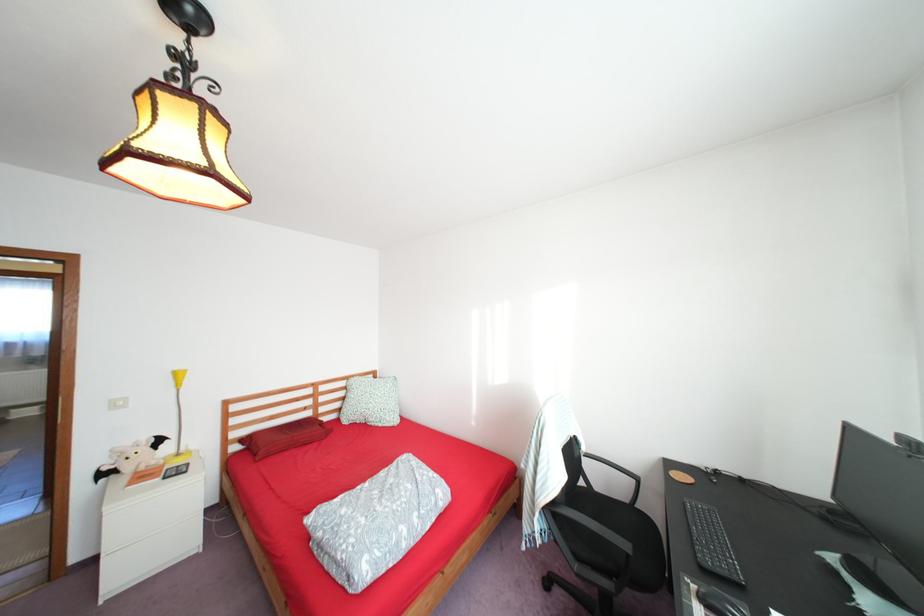
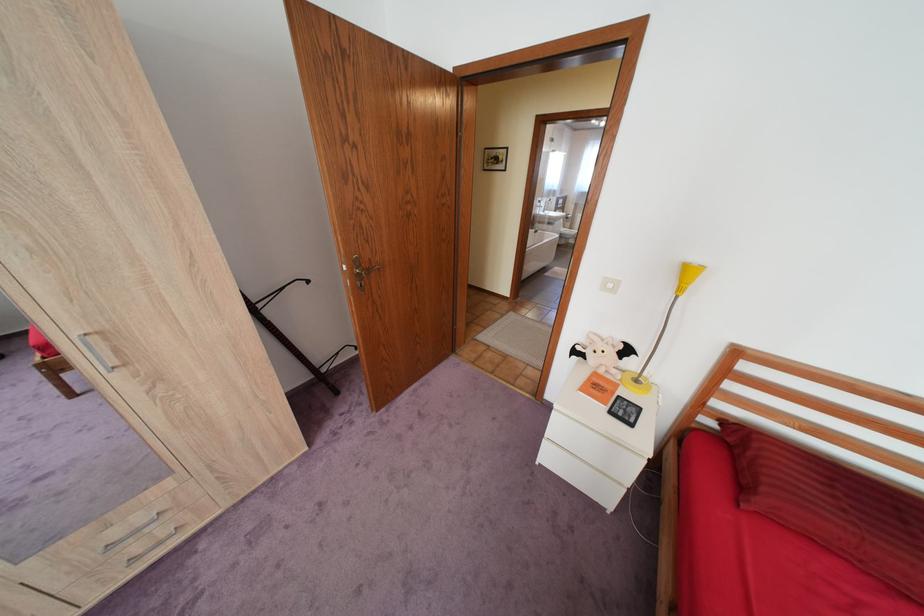
In the second image, find the point that corresponds to point (188, 454) in the first image.

(648, 379)